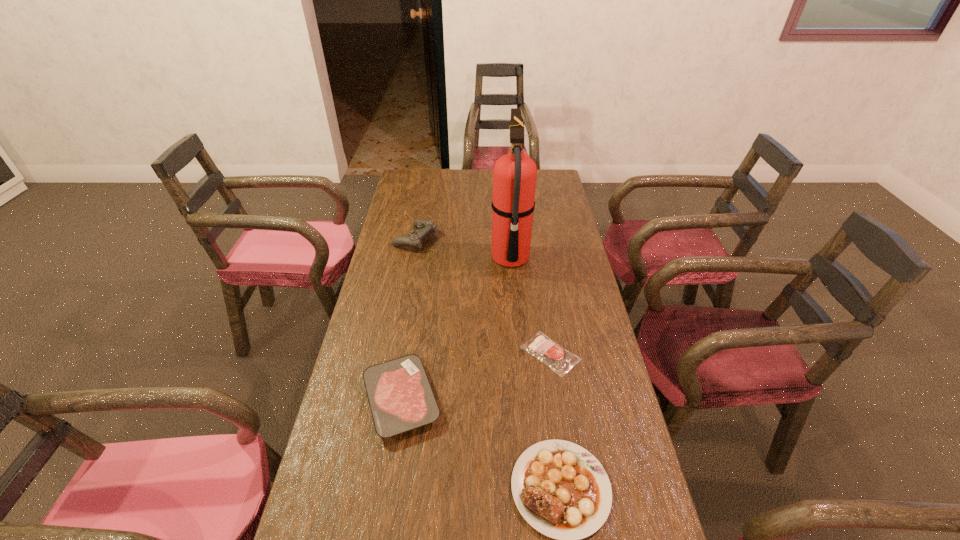
Identify the location of vacant space situated 0.240m on the back of the shortest object. Image resolution: width=960 pixels, height=540 pixels. (539, 279).

Locate an element on the screen. The image size is (960, 540). control positioned at the left edge is located at coordinates (425, 227).

The height and width of the screenshot is (540, 960). I want to click on steak at the left edge, so click(x=400, y=396).

Where is `object that is at the right edge`? The height and width of the screenshot is (540, 960). object that is at the right edge is located at coordinates (557, 358).

Locate an element on the screen. This screenshot has height=540, width=960. vacant area at the far edge is located at coordinates (462, 170).

What are the coordinates of `vacant space at the left edge of the desktop` in the screenshot? It's located at (356, 385).

Where is `vacant region at the right edge`? The height and width of the screenshot is (540, 960). vacant region at the right edge is located at coordinates (559, 204).

Image resolution: width=960 pixels, height=540 pixels. I want to click on vacant space at the far left corner of the desktop, so [x=424, y=186].

The image size is (960, 540). In the image, there is a desktop. In order to click on vacant area at the far right corner in this screenshot , I will do `click(546, 179)`.

Locate an element on the screen. The image size is (960, 540). free space between the tallest object and the shortest object is located at coordinates (530, 306).